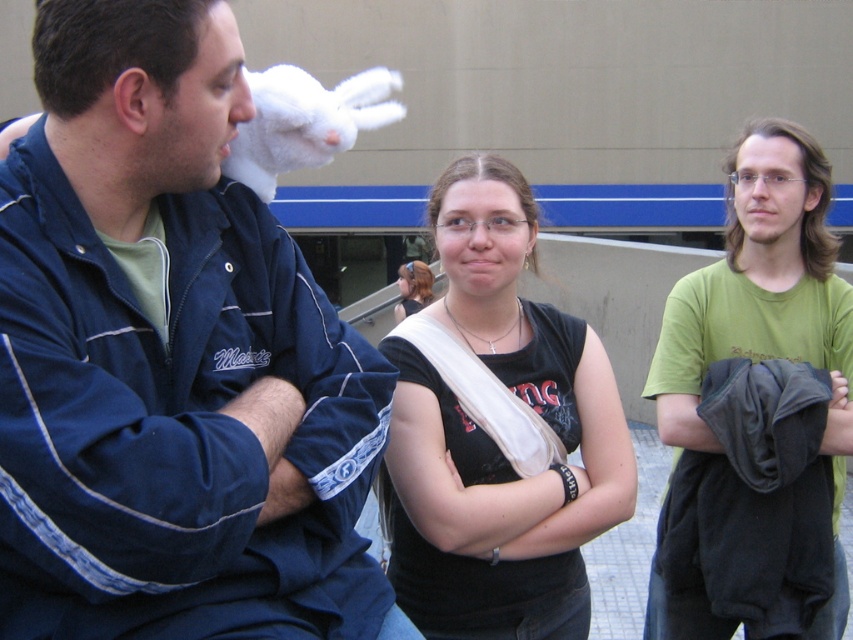
You are a photographer trying to capture a closeup shot of the translucent plastic nose at center without the white fluffy easter bunny at upper left blocking the view. Based on their sizes, can you position the camera so that the bunny is out of frame while keeping the nose in focus?

The white fluffy easter bunny at upper left is taller than the translucent plastic nose at center, so positioning the camera lower to avoid the bunny while focusing on the nose might work.

You are a photographer trying to capture a closeup of the black matte tank top at center and the white fluffy easter bunny at upper left. Since you want to focus on both subjects, which one should you adjust your camera focus to prioritize based on their positions?

The black matte tank top at center is taller than the white fluffy easter bunny at upper left, so you should prioritize focusing on the black matte tank top at center since it is larger and might be more prominent in the frame.

You are trying to decide which item to grab first from the scene. Since you need to pick the wider one, which one should you choose between the black matte tank top at center and the white fluffy easter bunny at upper left?

The black matte tank top at center is wider than the white fluffy easter bunny at upper left, so you should choose the black matte tank top at center.